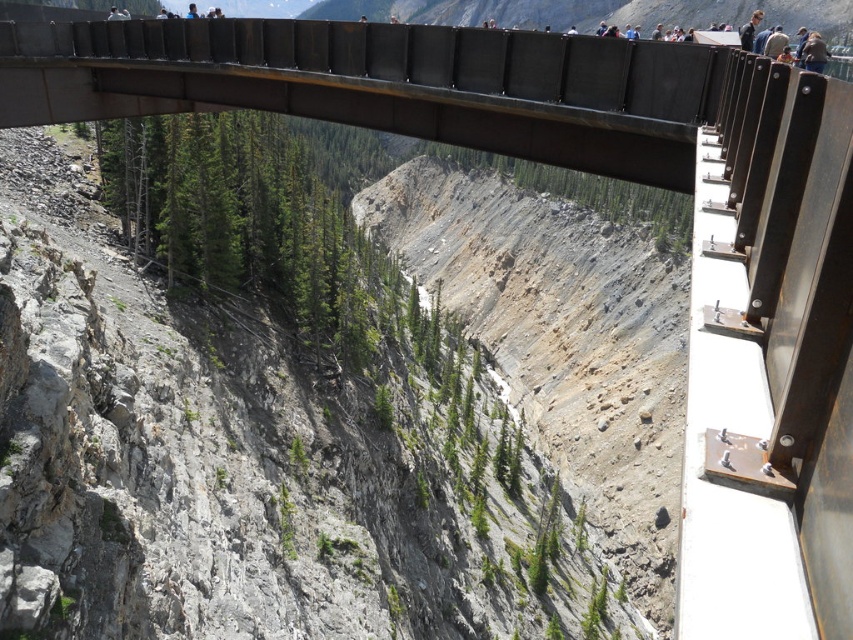
Between metallic bridge at center and dark brown leather jacket at upper center, which one is positioned higher?

dark brown leather jacket at upper center is above.

Does metallic bridge at center lie in front of dark brown leather jacket at upper center?

That is False.

I want to click on metallic bridge at center, so click(383, 83).

The image size is (853, 640). In order to click on metallic bridge at center in this screenshot , I will do `click(383, 83)`.

Can you confirm if dull gray rock at center is thinner than dark brown leather jacket at upper center?

No.

Is point (619, 404) positioned after point (814, 52)?

Yes, point (619, 404) is farther from viewer.

Is point (486, 198) closer to viewer compared to point (804, 52)?

That is False.

Locate an element on the screen. Image resolution: width=853 pixels, height=640 pixels. dull gray rock at center is located at coordinates (561, 340).

Is point (636, 147) positioned after point (523, 323)?

No, it is in front of (523, 323).

Between point (221, 88) and point (515, 291), which one is positioned in front?

Point (221, 88)

Is point (20, 36) positioned before point (576, 312)?

That is True.

At what (x,y) coordinates should I click in order to perform the action: click on metallic bridge at center. Please return your answer as a coordinate pair (x, y). The width and height of the screenshot is (853, 640). Looking at the image, I should click on (383, 83).